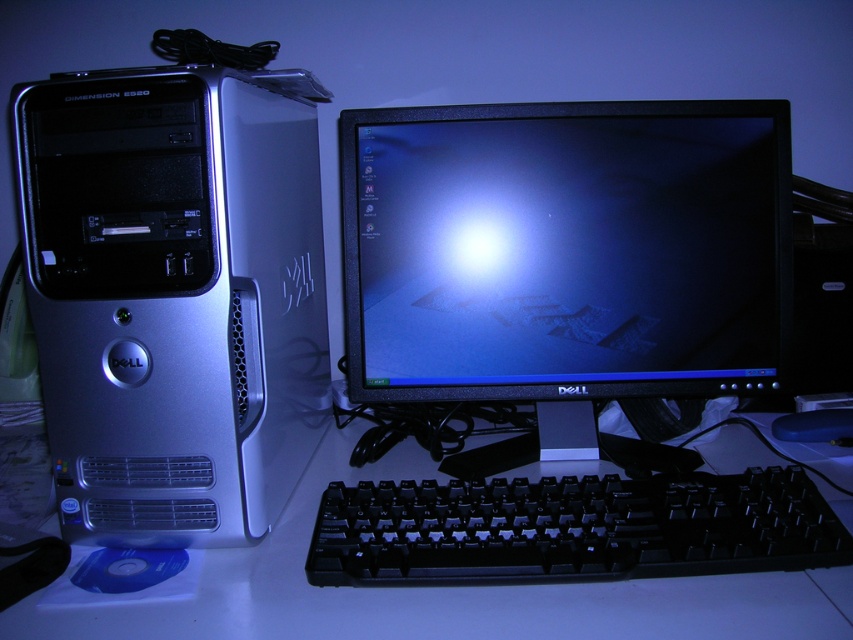
You are organizing cables on a desk and need to place the black plastic mouse at lower right next to the black glossy monitor at center. Considering their sizes, will the mouse fit comfortably next to the monitor without overcrowding the space?

The black glossy monitor at center is wider than the black plastic mouse at lower right, so placing the mouse next to it should be possible without overcrowding since the monitor takes up more space horizontally.

Based on the photo, you are setting up a new webcam for video calls. The webcam needs to be placed on top of the black glossy monitor at center so that it faces the user. However, there is a satin silver computer tower at left blocking the view. Can you move the webcam to another position on the desk without moving the existing objects?

The satin silver computer tower at left is in front of the black glossy monitor at center, so moving the webcam to the top of the monitor would place it behind the tower, blocking the view. Instead, you could position the webcam on the edge of the desk in front of the tower where it can face the user without obstruction.

You are trying to locate a specific point on the monitor. The point is at coordinates point (x=566, y=250). Where exactly is this point located on the monitor?

The point (x=566, y=250) is located on the black glossy monitor at center.